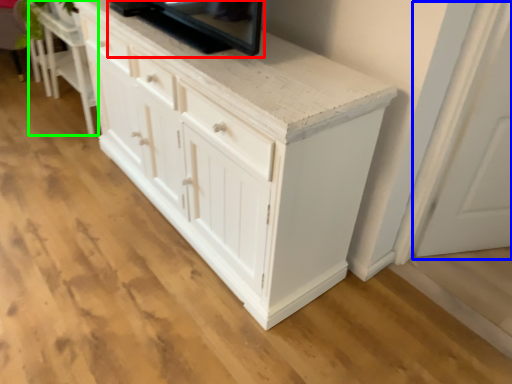
Question: Which is nearer to the appliance (highlighted by a red box)? glass door (highlighted by a blue box) or vanity (highlighted by a green box).

Choices:
 (A) glass door
 (B) vanity

Answer: (A)